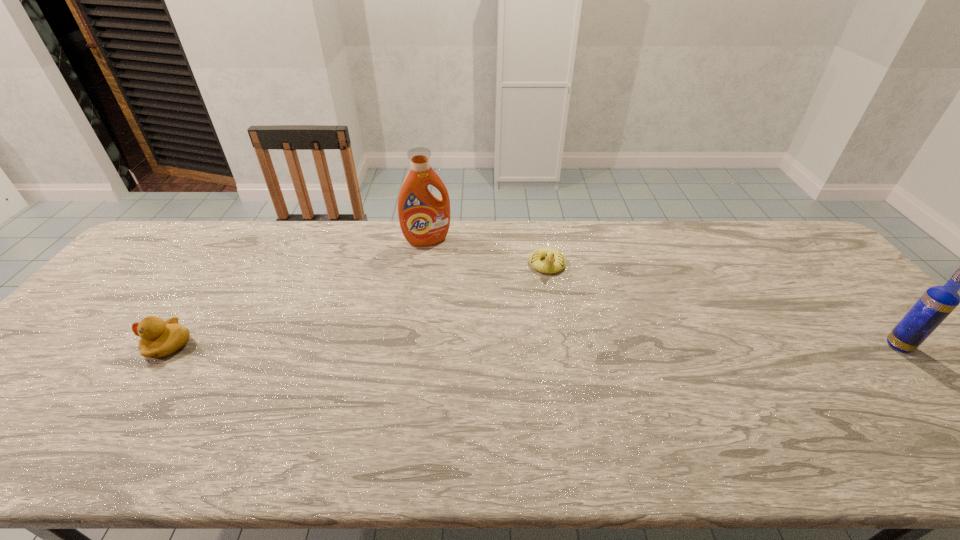
Where is `the leftmost object`? This screenshot has width=960, height=540. the leftmost object is located at coordinates (159, 338).

This screenshot has height=540, width=960. What are the coordinates of `the left duckling` in the screenshot? It's located at (159, 338).

This screenshot has height=540, width=960. I want to click on vodka, so click(x=934, y=306).

Image resolution: width=960 pixels, height=540 pixels. What are the coordinates of `the rightmost object` in the screenshot? It's located at (934, 306).

Identify the location of the second object from right to left. This screenshot has width=960, height=540. (549, 266).

In order to click on the second farthest object in this screenshot , I will do `click(549, 266)`.

At what (x,y) coordinates should I click in order to perform the action: click on detergent. Please return your answer as a coordinate pair (x, y). Looking at the image, I should click on (x=424, y=219).

This screenshot has width=960, height=540. Find the location of `the farthest object`. the farthest object is located at coordinates (424, 219).

Identify the location of vacant space located at the beak of the second shortest object. The width and height of the screenshot is (960, 540). click(x=107, y=345).

Locate an element on the screen. The height and width of the screenshot is (540, 960). free space located at the beak of the second shortest object is located at coordinates (79, 345).